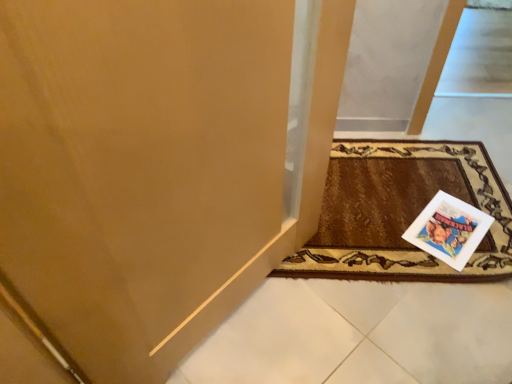
Measure the distance between point (404, 166) and camera.

The depth of point (404, 166) is 1.71 meters.

What are the coordinates of `brown woven mat at lower right` in the screenshot? It's located at (401, 212).

What do you see at coordinates (401, 212) in the screenshot? The image size is (512, 384). I see `brown woven mat at lower right` at bounding box center [401, 212].

Measure the distance between point (477, 237) and camera.

Point (477, 237) is 1.46 meters away from camera.

What do you see at coordinates (449, 230) in the screenshot? I see `white paper postcard at lower right` at bounding box center [449, 230].

Locate an element on the screen. white paper postcard at lower right is located at coordinates (449, 230).

At what (x,y) coordinates should I click in order to perform the action: click on brown woven mat at lower right. Please return your answer as a coordinate pair (x, y). The height and width of the screenshot is (384, 512). Looking at the image, I should click on (401, 212).

Can you confirm if brown woven mat at lower right is positioned to the left of white paper postcard at lower right?

Yes.

Considering the positions of objects brown woven mat at lower right and white paper postcard at lower right in the image provided, who is behind, brown woven mat at lower right or white paper postcard at lower right?

white paper postcard at lower right is more distant.

Considering the positions of point (347, 232) and point (405, 239), is point (347, 232) closer or farther from the camera than point (405, 239)?

Point (347, 232) is positioned farther from the camera compared to point (405, 239).

From the image's perspective, is brown woven mat at lower right positioned above or below white paper postcard at lower right?

brown woven mat at lower right is above white paper postcard at lower right.

Consider the image. From a real-world perspective, which is physically below, brown woven mat at lower right or white paper postcard at lower right?

white paper postcard at lower right is physically lower.

Does brown woven mat at lower right have a greater width compared to white paper postcard at lower right?

Yes.

Does brown woven mat at lower right have a greater height compared to white paper postcard at lower right?

Yes, brown woven mat at lower right is taller than white paper postcard at lower right.

Based on their sizes in the image, would you say brown woven mat at lower right is bigger or smaller than white paper postcard at lower right?

Clearly, brown woven mat at lower right is larger in size than white paper postcard at lower right.

Does brown woven mat at lower right contain white paper postcard at lower right?

That's correct, white paper postcard at lower right is inside brown woven mat at lower right.

Is brown woven mat at lower right in contact with white paper postcard at lower right?

brown woven mat at lower right and white paper postcard at lower right are not in contact.

Is brown woven mat at lower right facing towards white paper postcard at lower right?

Yes, brown woven mat at lower right is turned towards white paper postcard at lower right.

This screenshot has width=512, height=384. Identify the location of mat in front of the white paper postcard at lower right. (401, 212).

From the picture: Is white paper postcard at lower right at the right side of brown woven mat at lower right?

Indeed, white paper postcard at lower right is positioned on the right side of brown woven mat at lower right.

Does white paper postcard at lower right lie in front of brown woven mat at lower right?

That is False.

Which point is more distant from viewer, (474,236) or (360,192)?

The point (360,192) is farther.

From the image's perspective, relative to brown woven mat at lower right, is white paper postcard at lower right above or below?

Clearly, from the image's perspective, white paper postcard at lower right is below brown woven mat at lower right.

From a real-world perspective, which is physically below, white paper postcard at lower right or brown woven mat at lower right?

white paper postcard at lower right is physically lower.

Between white paper postcard at lower right and brown woven mat at lower right, which one has larger width?

Wider between the two is brown woven mat at lower right.

Is white paper postcard at lower right taller or shorter than brown woven mat at lower right?

In the image, white paper postcard at lower right appears to be shorter than brown woven mat at lower right.

Considering the sizes of white paper postcard at lower right and brown woven mat at lower right in the image, is white paper postcard at lower right bigger or smaller than brown woven mat at lower right?

In the image, white paper postcard at lower right appears to be smaller than brown woven mat at lower right.

Is white paper postcard at lower right not inside brown woven mat at lower right?

No, white paper postcard at lower right is inside brown woven mat at lower right's boundary.

Does white paper postcard at lower right touch brown woven mat at lower right?

white paper postcard at lower right and brown woven mat at lower right are not in contact.

Is white paper postcard at lower right positioned with its back to brown woven mat at lower right?

Yes.

How different are the orientations of white paper postcard at lower right and brown woven mat at lower right in degrees?

They differ by 39.8 degrees in their facing directions.

The width and height of the screenshot is (512, 384). In the image, there is a white paper postcard at lower right. Identify the location of mat above it (from the image's perspective). (401, 212).

This screenshot has height=384, width=512. What are the coordinates of `mat that is above the white paper postcard at lower right (from the image's perspective)` in the screenshot? It's located at (401, 212).

This screenshot has height=384, width=512. What are the coordinates of `postcard below the brown woven mat at lower right (from the image's perspective)` in the screenshot? It's located at (449, 230).